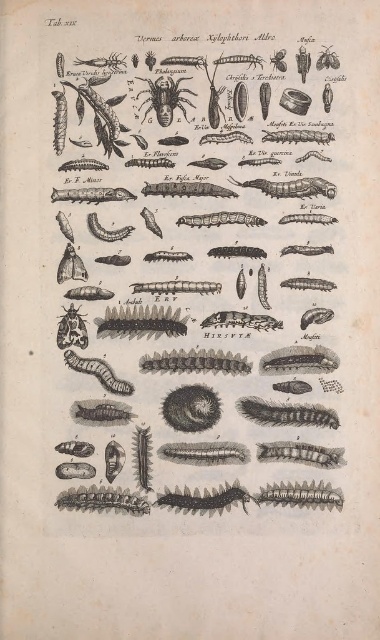
Question: Among these objects, which one is farthest from the camera?

Choices:
 (A) black ink caterpillar at center
 (B) grayish-brown textured caterpillar at center

Answer: (B)

Question: Among these objects, which one is nearest to the camera?

Choices:
 (A) grayish-brown textured caterpillar at center
 (B) grayish matte caterpillar at center
 (C) black ink caterpillar at center

Answer: (C)

Question: Observing the image, what is the correct spatial positioning of black ink caterpillar at center in reference to grayish matte caterpillar at center?

Choices:
 (A) left
 (B) right

Answer: (B)

Question: Can you confirm if black ink caterpillar at center is positioned below grayish-brown textured caterpillar at center?

Choices:
 (A) no
 (B) yes

Answer: (A)

Question: Does grayish-brown textured caterpillar at center appear over grayish matte caterpillar at center?

Choices:
 (A) yes
 (B) no

Answer: (B)

Question: Among these points, which one is farthest from the camera?

Choices:
 (A) (88, 371)
 (B) (319, 413)
 (C) (270, 172)

Answer: (C)